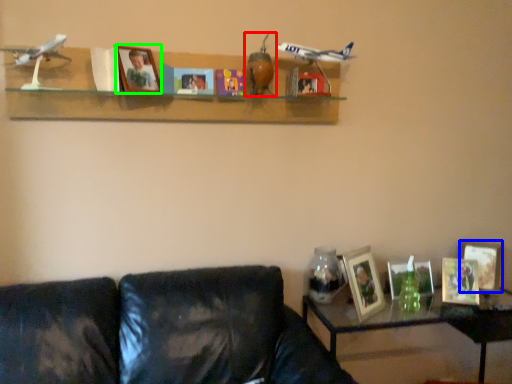
Question: Estimate the real-world distances between objects in this image. Which object is closer to toy (highlighted by a red box), picture frame (highlighted by a blue box) or picture frame (highlighted by a green box)?

Choices:
 (A) picture frame
 (B) picture frame

Answer: (B)